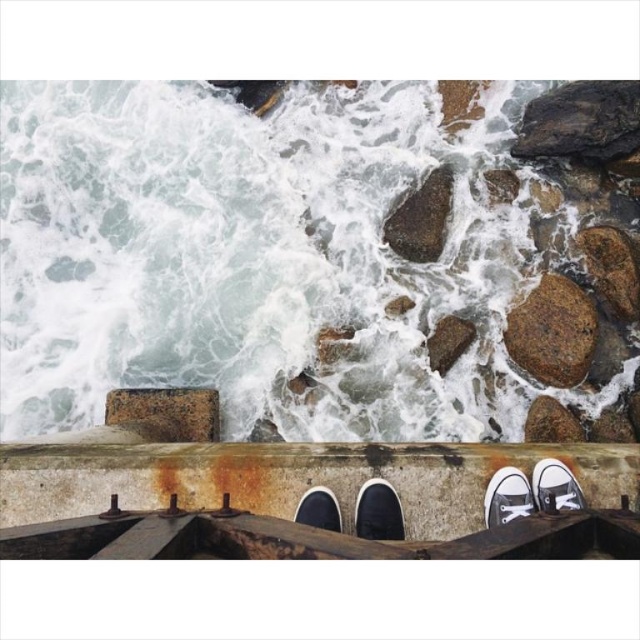
You are a lifeguard on duty at the beach. You notice two shoes washed ashore near the rocks. The black canvas shoe at center is in the middle of the turbulent waves, and the white canvas shoe at lower right is near the rocks. If you want to retrieve both shoes, which one should you go for first to minimize the risk of being swept away by the waves?

You should retrieve the white canvas shoe at lower right first because it is closer to the rocks, which are a safer area compared to the black canvas shoe at center located in the turbulent waves.

You are standing at the edge of the concrete structure in the foreground of the coastal scene. There is a point marked at coordinates (x=381, y=540). Can you safely reach this point without getting too close to the crashing waves?

The point at (x=381, y=540) is 11.39 feet away from the viewer. Since the waves are crashing against the rocks in the middle ground, maintaining a distance of over 10 feet should keep you safe from the spray and force of the waves.

You are standing on the concrete structure and see the white frothy water at upper left and the black canvas shoe at center. Which object is closer to you?

The white frothy water at upper left is closer to you because it is further to the viewer than the black canvas shoe at center.